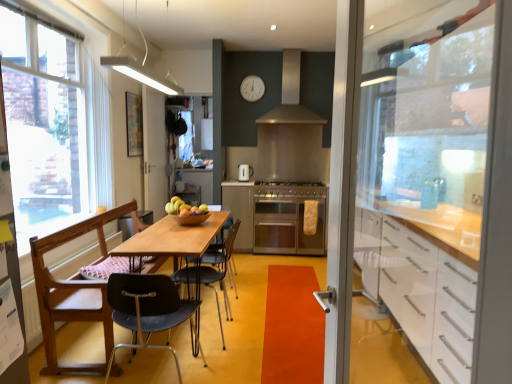
Question: Could you tell me if orange matte door handle at center is turned towards stainless steel oven at center?

Choices:
 (A) no
 (B) yes

Answer: (A)

Question: Is orange matte door handle at center not close to stainless steel oven at center?

Choices:
 (A) no
 (B) yes

Answer: (B)

Question: Considering the relative sizes of orange matte door handle at center and stainless steel oven at center in the image provided, is orange matte door handle at center thinner than stainless steel oven at center?

Choices:
 (A) yes
 (B) no

Answer: (B)

Question: From a real-world perspective, is orange matte door handle at center located higher than stainless steel oven at center?

Choices:
 (A) no
 (B) yes

Answer: (A)

Question: Considering the relative positions of orange matte door handle at center and stainless steel oven at center in the image provided, is orange matte door handle at center to the right of stainless steel oven at center from the viewer's perspective?

Choices:
 (A) yes
 (B) no

Answer: (B)

Question: Is orange matte door handle at center positioned with its back to stainless steel oven at center?

Choices:
 (A) no
 (B) yes

Answer: (A)

Question: Does black plastic chair at center, positioned as the third chair in back-to-front order, come in front of black plastic chair at center, the third chair in the front-to-back sequence?

Choices:
 (A) yes
 (B) no

Answer: (A)

Question: From the image's perspective, is black plastic chair at center, the first chair when ordered from front to back, above black plastic chair at center, which is the 1th chair from back to front?

Choices:
 (A) yes
 (B) no

Answer: (B)

Question: Is black plastic chair at center, positioned as the third chair in back-to-front order, taller than black plastic chair at center, which is the 1th chair from back to front?

Choices:
 (A) no
 (B) yes

Answer: (A)

Question: Is black plastic chair at center, the first chair when ordered from front to back, positioned with its back to black plastic chair at center, which is the 1th chair from back to front?

Choices:
 (A) yes
 (B) no

Answer: (B)

Question: Does black plastic chair at center, the first chair when ordered from front to back, appear on the left side of black plastic chair at center, the third chair in the front-to-back sequence?

Choices:
 (A) no
 (B) yes

Answer: (B)

Question: Does black plastic chair at center, positioned as the third chair in back-to-front order, turn towards black plastic chair at center, the third chair in the front-to-back sequence?

Choices:
 (A) no
 (B) yes

Answer: (B)

Question: Can you confirm if transparent glass screen door at center, the 2th screen door in the front-to-back sequence, is thinner than clear glass window at left?

Choices:
 (A) yes
 (B) no

Answer: (A)